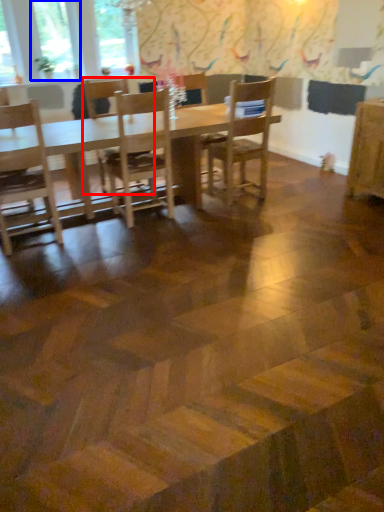
Question: Which point is further to the camera, chair (highlighted by a red box) or window (highlighted by a blue box)?

Choices:
 (A) chair
 (B) window

Answer: (B)